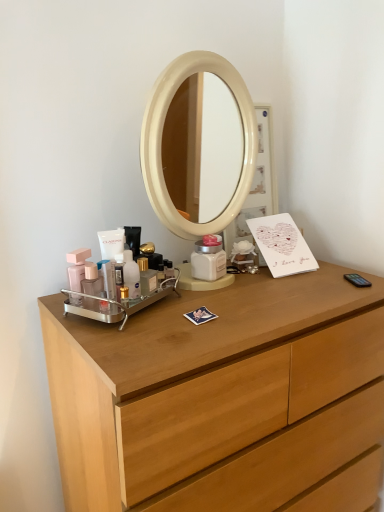
This screenshot has width=384, height=512. I want to click on free space in front of translucent plastic bottle at center, placed as the fourth toiletry when sorted from left to right, so 131,334.